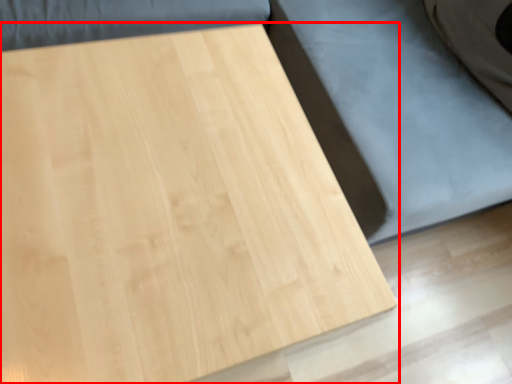
Question: From the image's perspective, considering the relative positions of table (annotated by the red box) and bed frame in the image provided, where is table (annotated by the red box) located with respect to the staircase?

Choices:
 (A) above
 (B) below

Answer: (B)